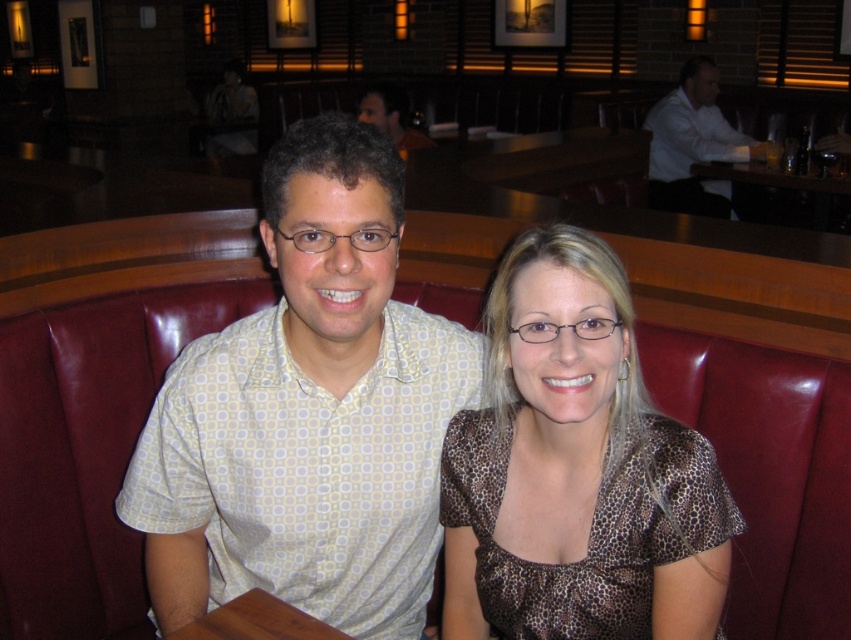
Question: Which of the following is the farthest from the observer?

Choices:
 (A) (386, 634)
 (B) (710, 93)
 (C) (661, 632)

Answer: (B)

Question: Does brown leopard print blouse at center have a lesser width compared to white shirt at upper right?

Choices:
 (A) yes
 (B) no

Answer: (A)

Question: Is brown leopard print blouse at center bigger than white shirt at upper right?

Choices:
 (A) yes
 (B) no

Answer: (B)

Question: Which object is positioned farthest from the brown leopard print blouse at center?

Choices:
 (A) white dotted shirt at center
 (B) white shirt at upper right

Answer: (B)

Question: Among these points, which one is nearest to the camera?

Choices:
 (A) (672, 122)
 (B) (537, 582)
 (C) (363, 202)

Answer: (C)

Question: Can you confirm if white dotted shirt at center is positioned to the left of brown leopard print blouse at center?

Choices:
 (A) no
 (B) yes

Answer: (B)